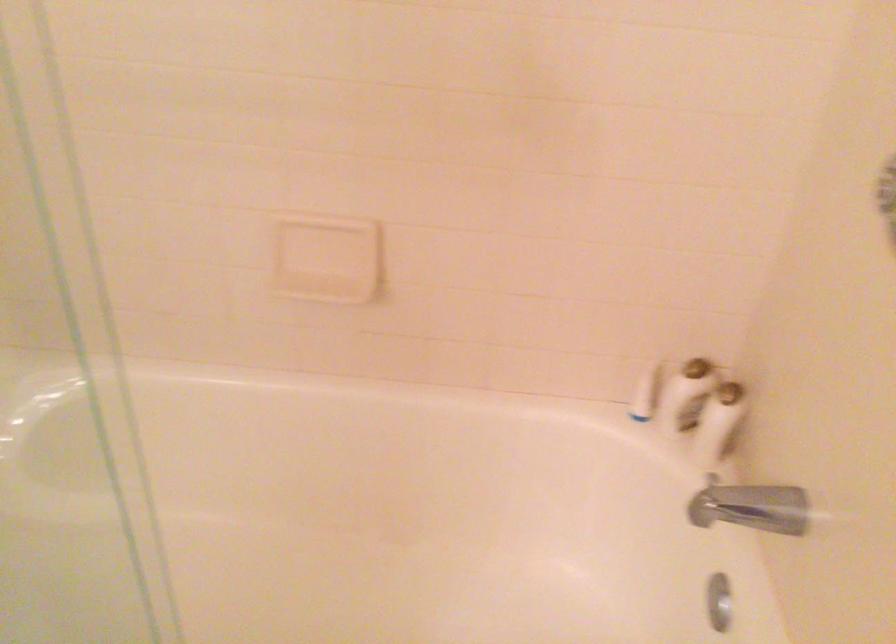
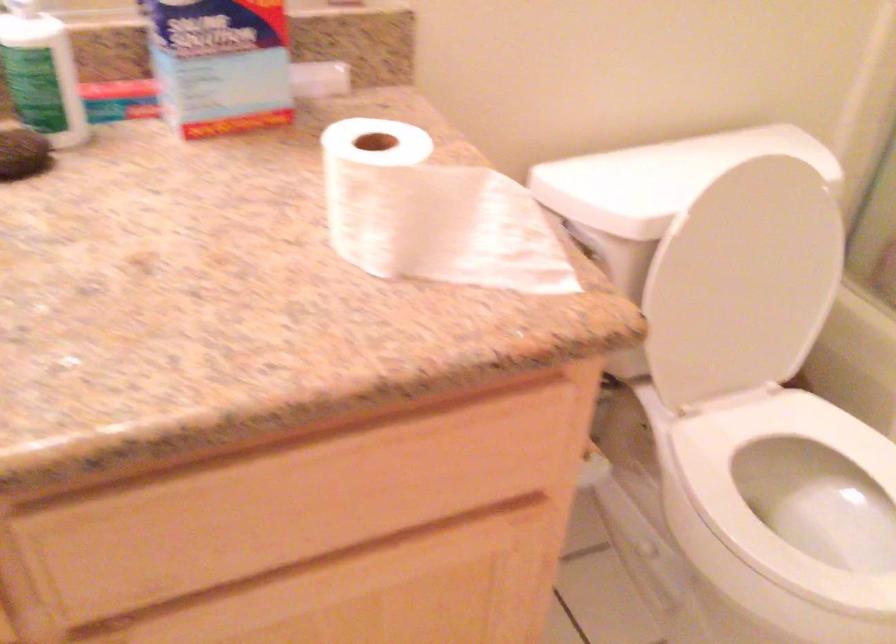
Question: The first image is from the beginning of the video and the second image is from the end. How did the camera likely rotate when shooting the video?

Choices:
 (A) Left
 (B) Right
 (C) Up
 (D) Down

Answer: (A)